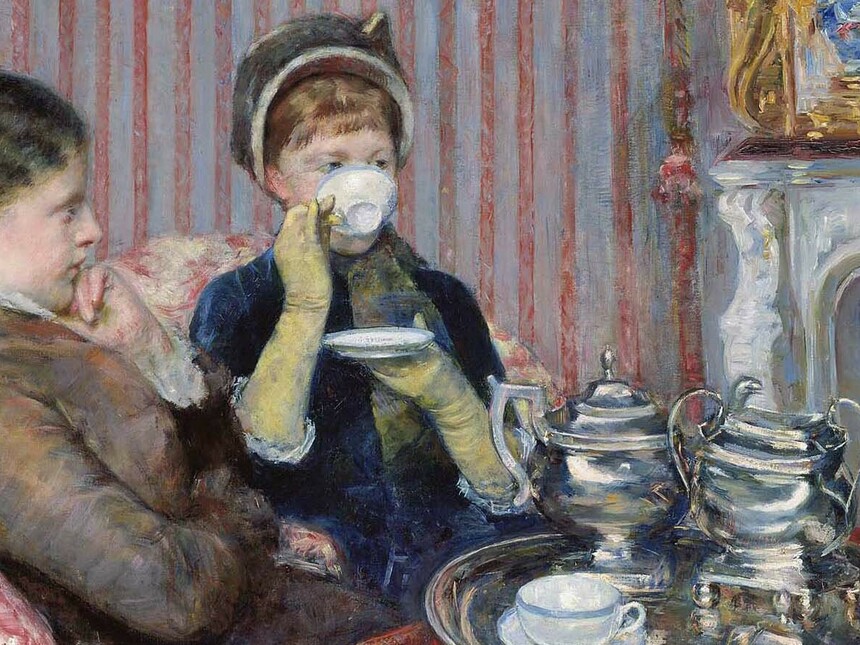
The image size is (860, 645). Find the location of `tea cup`. tea cup is located at coordinates click(x=364, y=220), click(x=554, y=602).